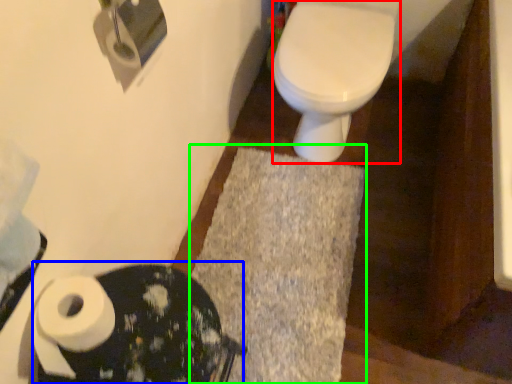
Question: Considering the real-world distances, which object is farthest from bidet (highlighted by a red box)? porcelain (highlighted by a blue box) or bath mat (highlighted by a green box)?

Choices:
 (A) porcelain
 (B) bath mat

Answer: (A)